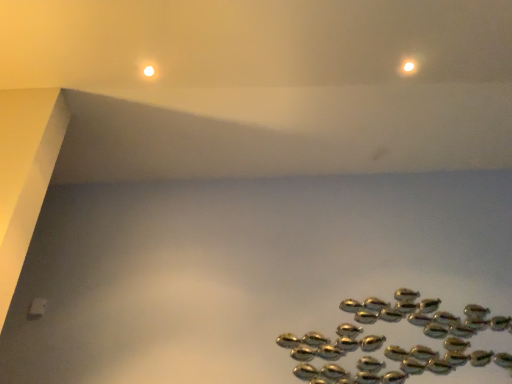
Question: Should I look upward or downward to see metallic gold fish at lower right?

Choices:
 (A) down
 (B) up

Answer: (A)